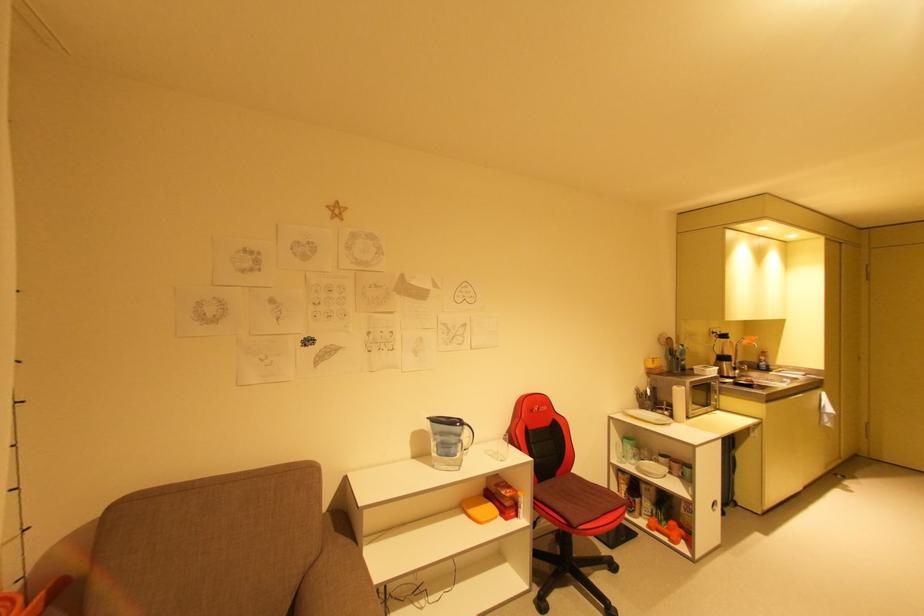
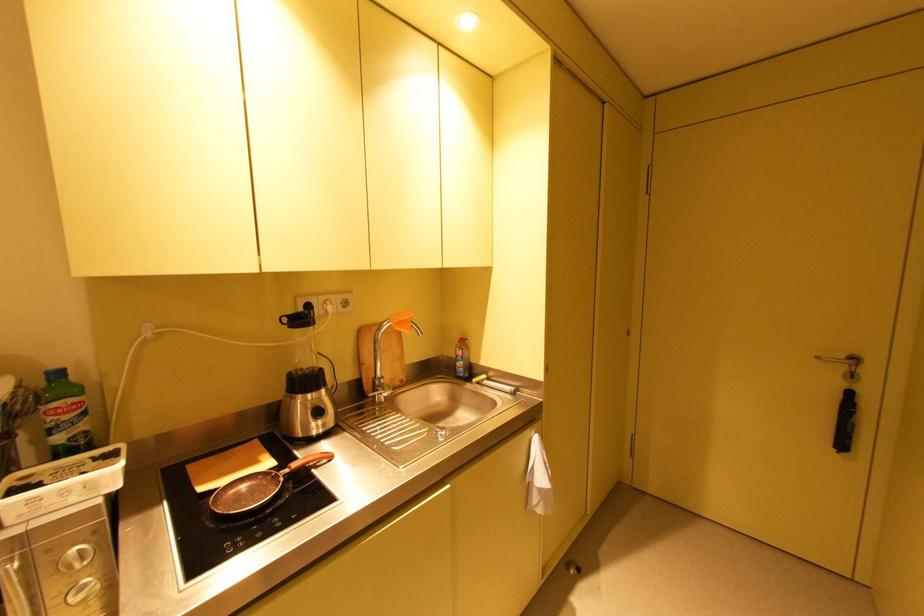
In the second image, find the point that corresponds to point (756, 341) in the first image.

(400, 325)